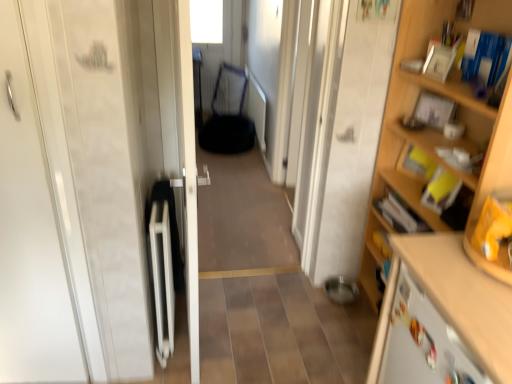
Question: Relative to wooden cabinet at lower right, is white glossy door at center, positioned as the second door in left-to-right order, in front or behind?

Choices:
 (A) behind
 (B) front

Answer: (A)

Question: Considering the positions of white glossy door at center, positioned as the second door in left-to-right order, and wooden cabinet at lower right in the image, is white glossy door at center, positioned as the second door in left-to-right order, taller or shorter than wooden cabinet at lower right?

Choices:
 (A) short
 (B) tall

Answer: (B)

Question: Which object is positioned farthest from the metallic mesh armchair at center?

Choices:
 (A) wooden cabinet at lower right
 (B) wooden shelf at right
 (C) white glossy door at center, positioned as the second door in left-to-right order
 (D) white glossy door at left, placed as the second door when sorted from right to left

Answer: (A)

Question: Which object is the farthest from the metallic mesh armchair at center?

Choices:
 (A) wooden shelf at right
 (B) wooden cabinet at lower right
 (C) white glossy door at left, which appears as the first door when viewed from the left
 (D) white glossy door at center, which is the first door in right-to-left order

Answer: (B)